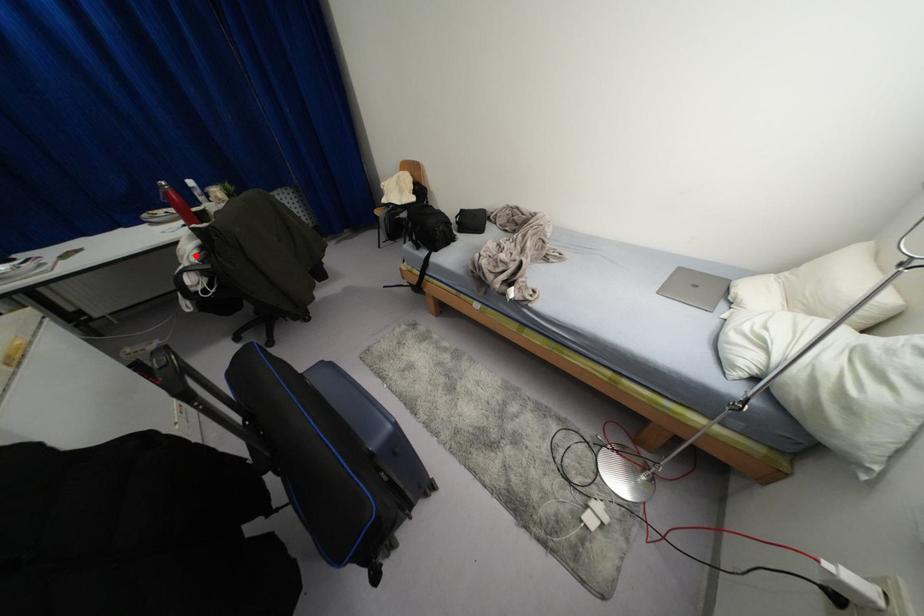
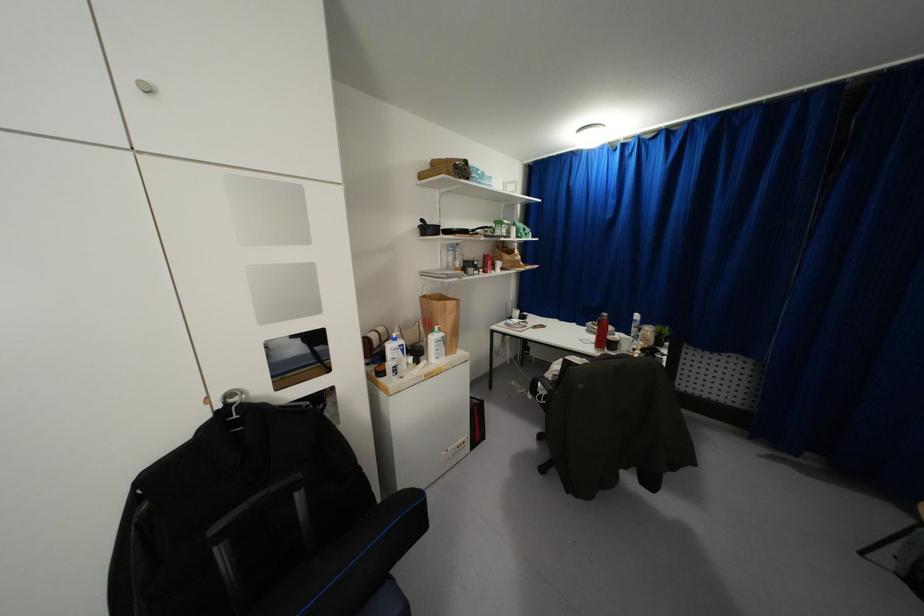
Question: I am providing you with two images of the same scene from different viewpoints. Image1 has a red point marked. In image2, the corresponding 3D location appears at what relative position? Reply with the corresponding letter.

Choices:
 (A) Closer
 (B) Farther

Answer: (A)